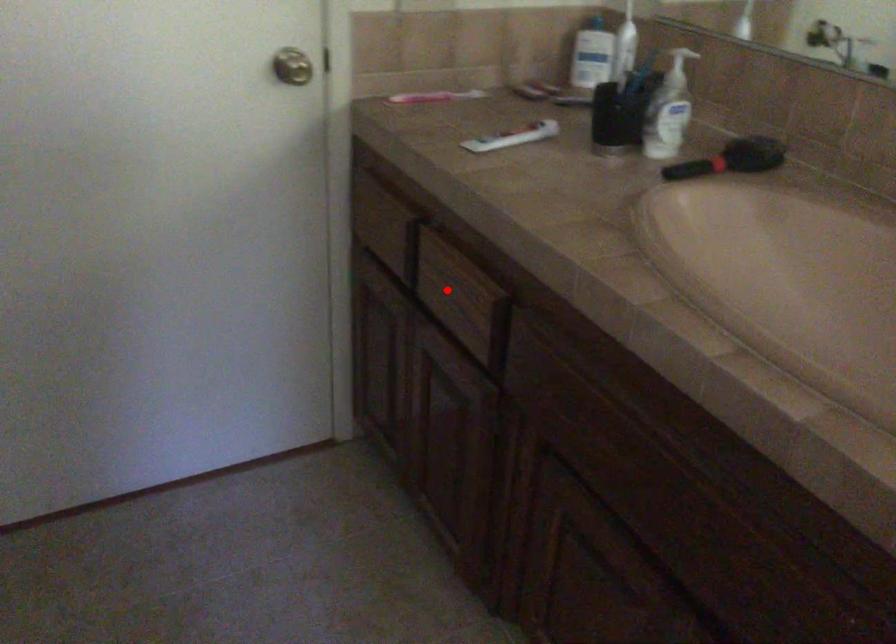
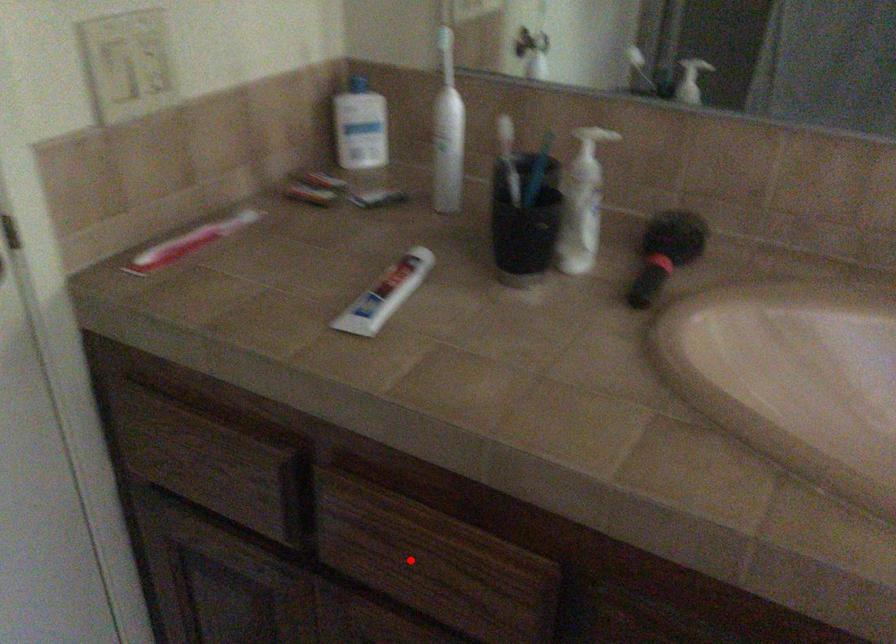
I am providing you with two images of the same scene from different viewpoints. A red point is marked on the first image and another point is marked on the second image. Are the points marked in image1 and image2 representing the same 3D position?

Yes